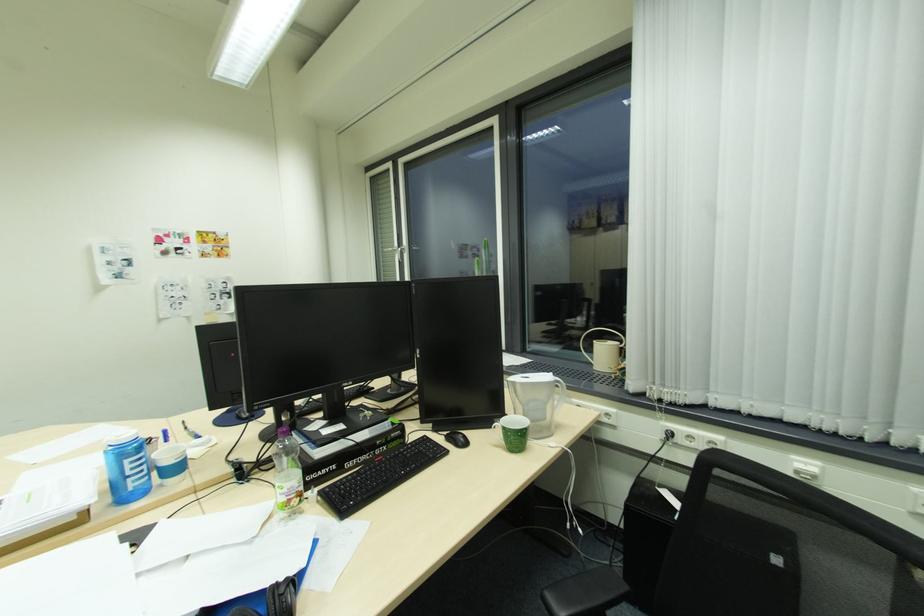
What do you see at coordinates (496, 432) in the screenshot? I see `the green mug handle` at bounding box center [496, 432].